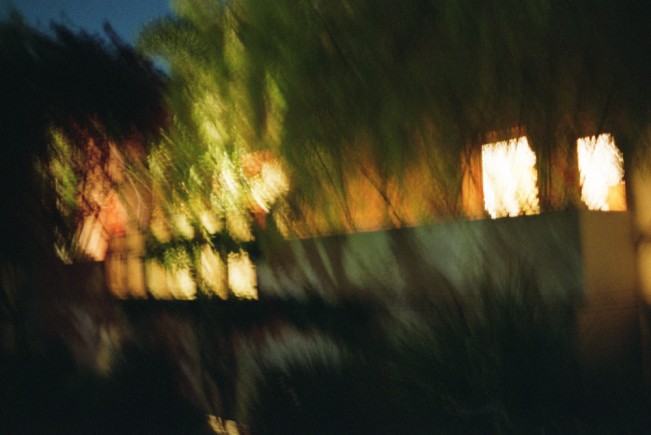
The image size is (651, 435). Identify the location of window. (603, 178), (510, 172).